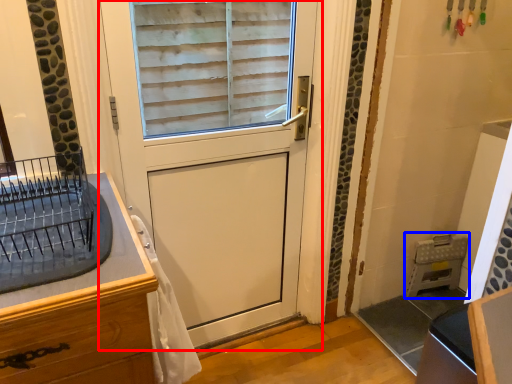
Question: Which point is further to the camera, door (highlighted by a red box) or appliance (highlighted by a blue box)?

Choices:
 (A) door
 (B) appliance

Answer: (B)